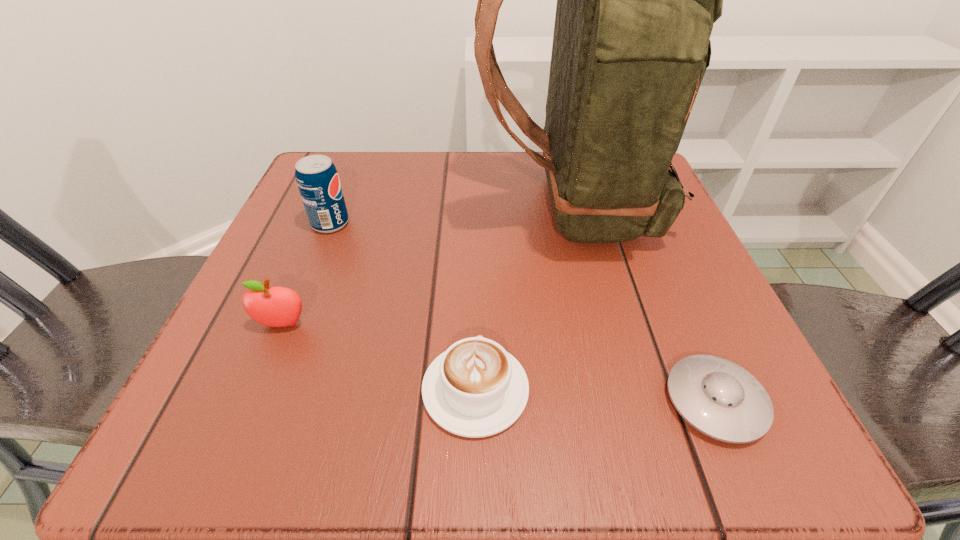
Where is `apple located at the left edge`? apple located at the left edge is located at coordinates (271, 306).

Find the location of a particular element. This screenshot has width=960, height=540. backpack positioned at the right edge is located at coordinates (636, 0).

Where is `saucer located at the right edge`? The width and height of the screenshot is (960, 540). saucer located at the right edge is located at coordinates (719, 398).

Identify the location of object that is at the far left corner. The width and height of the screenshot is (960, 540). (317, 179).

You are a GUI agent. You are given a task and a screenshot of the screen. Output one action in this format:
    pyautogui.click(x=<x>, y=<y>)
    Task: Click on the object that is at the far right corner
    This screenshot has width=960, height=540.
    Given the screenshot: What is the action you would take?
    pyautogui.click(x=636, y=0)

The image size is (960, 540). Find the location of `object located in the near right corner section of the desktop`. object located in the near right corner section of the desktop is located at coordinates (719, 398).

Where is `vacant region at the far edge`? vacant region at the far edge is located at coordinates (416, 208).

Where is `free region at the near edge`? free region at the near edge is located at coordinates (396, 455).

This screenshot has width=960, height=540. I want to click on free location at the left edge of the desktop, so click(x=276, y=380).

The width and height of the screenshot is (960, 540). In the image, there is a desktop. Find the location of `free region at the far left corner`. free region at the far left corner is located at coordinates (373, 189).